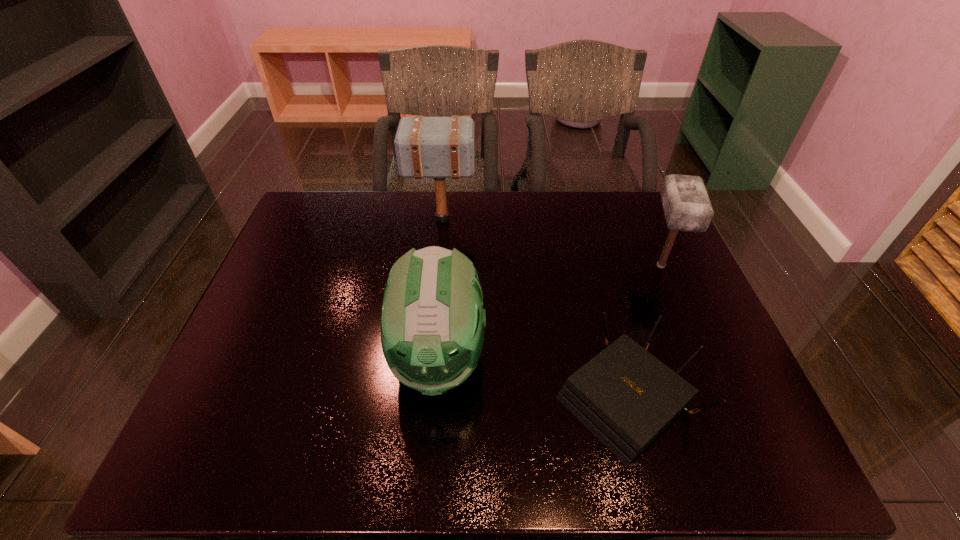
At what (x,y) coordinates should I click in order to perform the action: click on the farthest object. Please return your answer as a coordinate pair (x, y). The image size is (960, 540). Looking at the image, I should click on (426, 147).

Find the location of a particular element. The image size is (960, 540). the left mallet is located at coordinates (426, 147).

Find the location of a particular element. This screenshot has height=540, width=960. the third nearest object is located at coordinates (686, 204).

Locate an element on the screen. Image resolution: width=960 pixels, height=540 pixels. the right mallet is located at coordinates (686, 204).

Where is `football helmet`? The image size is (960, 540). football helmet is located at coordinates (432, 325).

Where is `router`? router is located at coordinates (625, 396).

Where is `vacant area situated 0.220m on the striking surface of the farther mallet`? The height and width of the screenshot is (540, 960). vacant area situated 0.220m on the striking surface of the farther mallet is located at coordinates (542, 220).

The height and width of the screenshot is (540, 960). I want to click on vacant space located 0.140m on the front of the second farthest object, so click(x=686, y=326).

Where is `blank area located 0.100m on the visor of the football helmet`? The height and width of the screenshot is (540, 960). blank area located 0.100m on the visor of the football helmet is located at coordinates (430, 461).

I want to click on free space located 0.140m on the left of the router, so click(x=493, y=397).